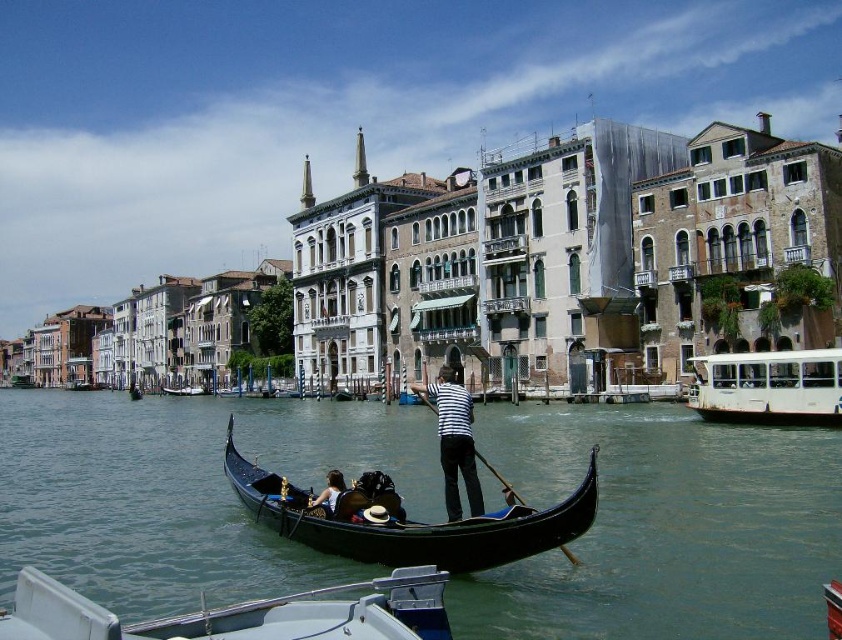
Is black polished wood gondola at center taller than white matte boat at right?

In fact, black polished wood gondola at center may be shorter than white matte boat at right.

Where is `black polished wood gondola at center`? black polished wood gondola at center is located at coordinates (409, 522).

In order to click on black polished wood gondola at center in this screenshot , I will do `click(409, 522)`.

Can you confirm if white matte boat at right is taller than striped fabric person at center?

No.

Is point (781, 401) positioned after point (445, 413)?

Yes, point (781, 401) is farther from viewer.

This screenshot has width=842, height=640. I want to click on white matte boat at right, so click(x=769, y=387).

Between point (36, 577) and point (453, 493), which one is positioned behind?

The point (453, 493) is more distant.

Does white plastic boat at lower center appear under striped fabric person at center?

Yes, white plastic boat at lower center is below striped fabric person at center.

Between point (301, 611) and point (461, 451), which one is positioned behind?

Positioned behind is point (461, 451).

The image size is (842, 640). What are the coordinates of `white plastic boat at lower center` in the screenshot? It's located at (243, 612).